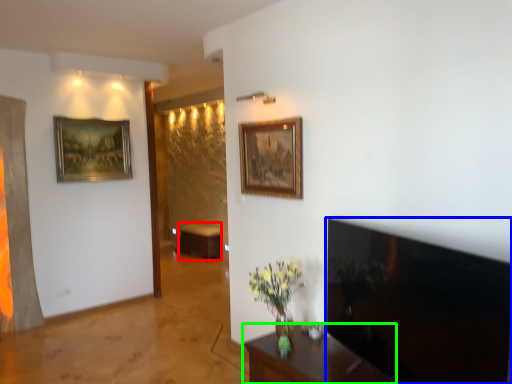
Question: Which is farther away from table (highlighted by a red box)? television (highlighted by a blue box) or furniture (highlighted by a green box)?

Choices:
 (A) television
 (B) furniture

Answer: (A)